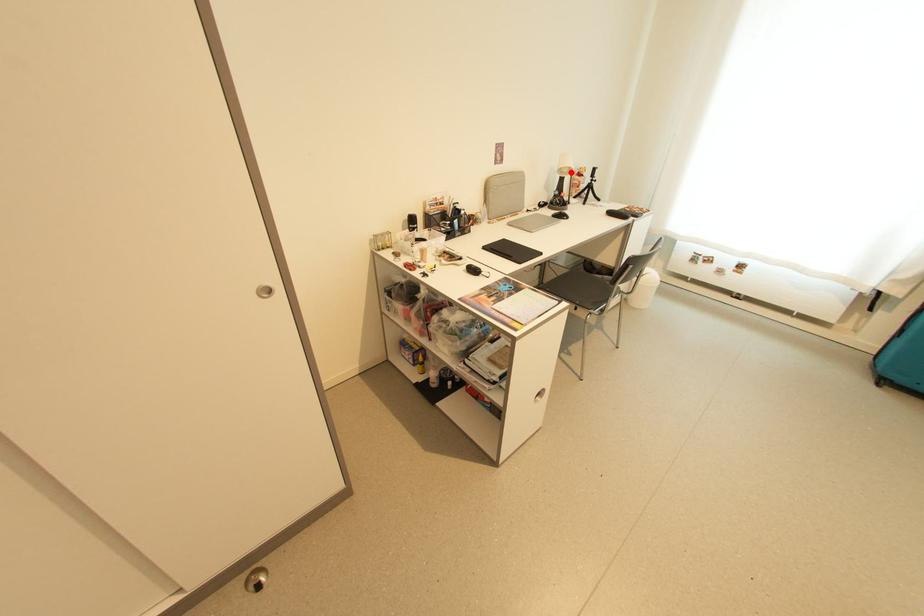
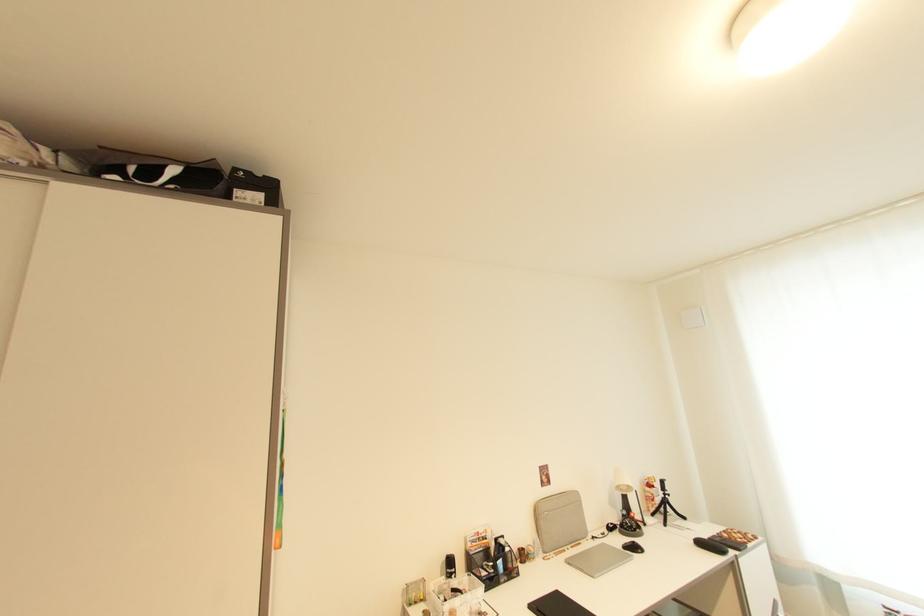
Question: I am providing you with two images of the same scene from different viewpoints. In image1, a red point is highlighted. Considering the same 3D point in image2, which of the following is correct?

Choices:
 (A) It is closer
 (B) It is farther

Answer: (B)